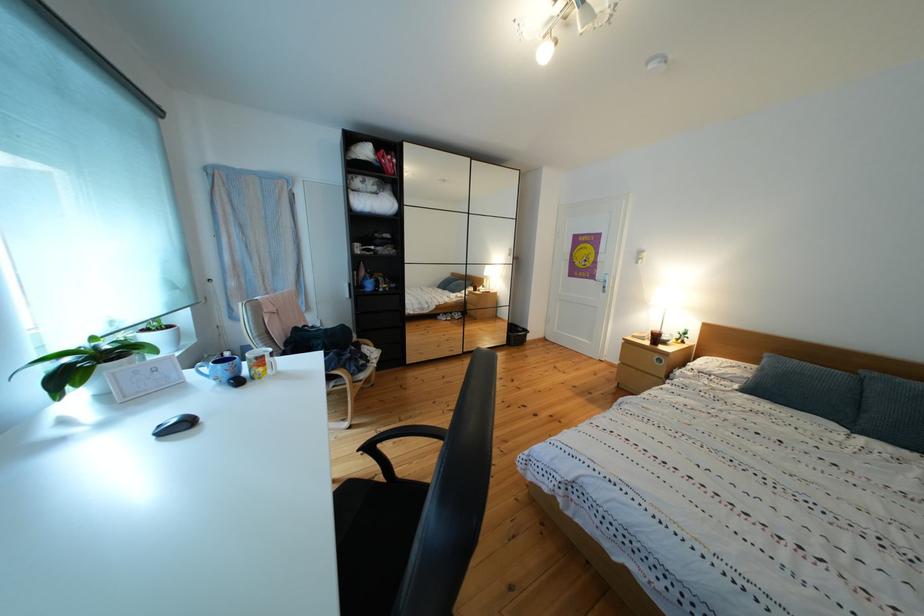
Identify the location of black chair armrest. (397, 439).